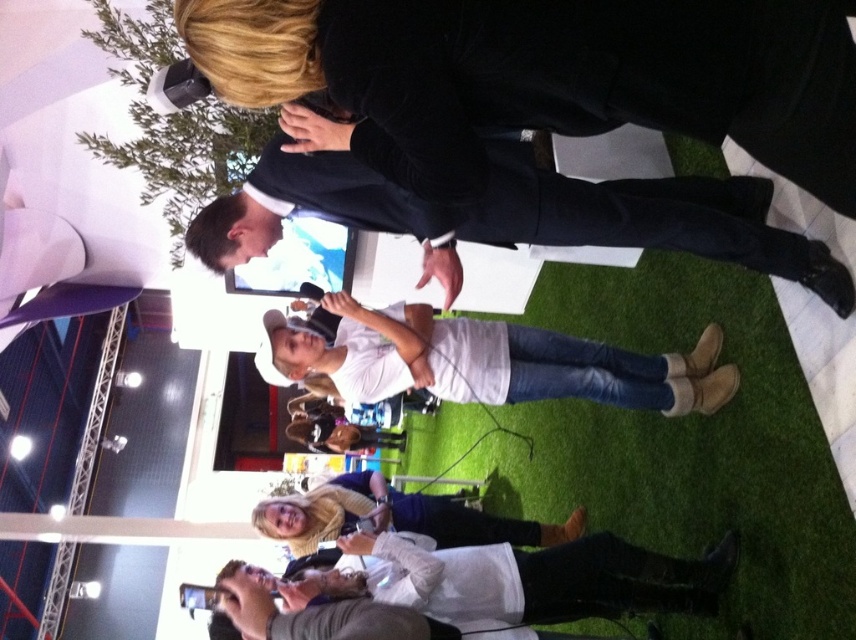
You are attending the expo and want to take a photo of the white matte shirt at center and the matte white phone at center. Which object should you focus on first if you want to capture both in the same frame without moving the camera?

You should focus on the white matte shirt at center first because it is above the matte white phone at center, so adjusting focus to the shirt will ensure the phone is within the depth of field if they are at similar distances.

You are organizing a photo shoot and need to place two props next to each other. The black velvet suit at upper center and the white matte shirt at center must be positioned so that the thinner one is on the left. Which object should be placed on the left?

The black velvet suit at upper center is thinner than the white matte shirt at center, so the black velvet suit at upper center should be placed on the left.